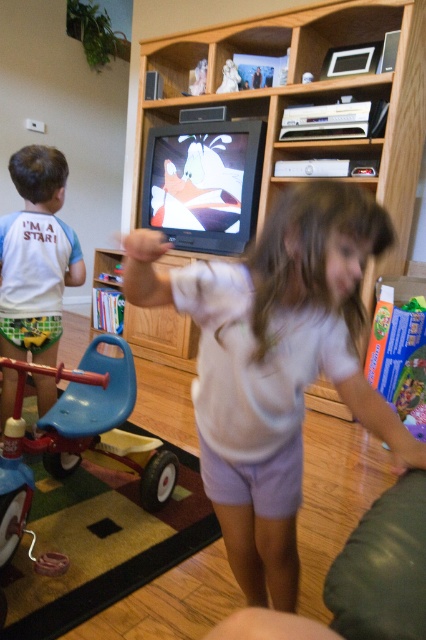
Question: Is white cotton shirt at center bigger than wooden entertainment center at center?

Choices:
 (A) no
 (B) yes

Answer: (A)

Question: Does white cotton shirt at center appear on the right side of wooden entertainment center at center?

Choices:
 (A) yes
 (B) no

Answer: (B)

Question: Which point is farther to the camera?

Choices:
 (A) white cotton shirt at center
 (B) wooden entertainment center at center
 (C) white cotton shirt at left
 (D) blue plastic tricycle at lower left

Answer: (B)

Question: Which of these objects is positioned farthest from the wooden entertainment center at center?

Choices:
 (A) blue plastic tricycle at lower left
 (B) white cotton shirt at center
 (C) white cotton shirt at left

Answer: (B)

Question: Does white cotton shirt at center appear on the right side of wooden entertainment center at center?

Choices:
 (A) no
 (B) yes

Answer: (A)

Question: Which object is positioned closest to the blue plastic tricycle at lower left?

Choices:
 (A) wooden entertainment center at center
 (B) white cotton shirt at center

Answer: (B)